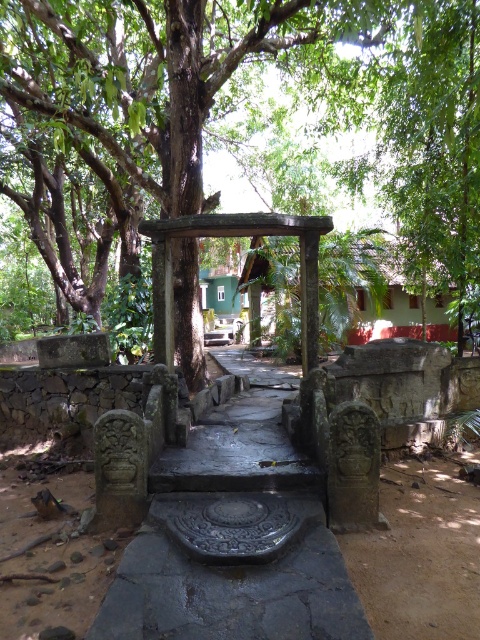
Question: Which object is closer to the camera taking this photo?

Choices:
 (A) carved stone gazebo at center
 (B) green leafy tree at center

Answer: (A)

Question: Can you confirm if green leafy tree at center is bigger than carved stone gazebo at center?

Choices:
 (A) yes
 (B) no

Answer: (B)

Question: Which point is farther to the camera?

Choices:
 (A) carved stone gazebo at center
 (B) green leafy tree at center

Answer: (B)

Question: Can you confirm if green leafy tree at center is positioned below carved stone gazebo at center?

Choices:
 (A) no
 (B) yes

Answer: (A)

Question: In this image, where is green leafy tree at center located relative to carved stone gazebo at center?

Choices:
 (A) below
 (B) above

Answer: (B)